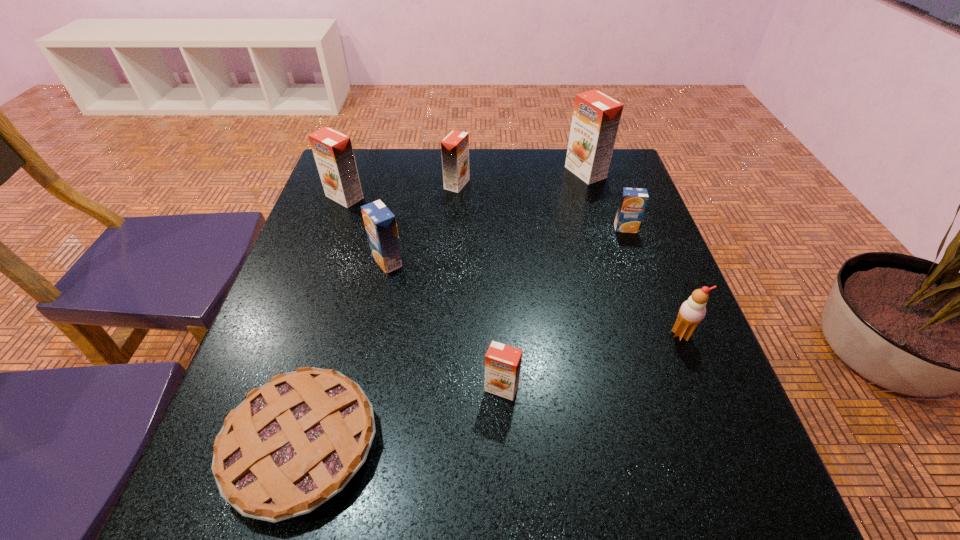
I want to click on the tallest orange juice, so click(596, 116).

What are the coordinates of `the biggest orange orange juice` in the screenshot? It's located at (596, 116).

In order to click on the seventh shortest object in this screenshot , I will do `click(332, 150)`.

The width and height of the screenshot is (960, 540). Find the location of `the leftmost orange orange juice`. the leftmost orange orange juice is located at coordinates point(332,150).

You are a GUI agent. You are given a task and a screenshot of the screen. Output one action in this format:
    pyautogui.click(x=<x>, y=<y>)
    Task: Click on the third orange orange juice from right to left
    The height and width of the screenshot is (540, 960).
    Given the screenshot: What is the action you would take?
    pyautogui.click(x=455, y=146)

The height and width of the screenshot is (540, 960). What are the coordinates of `the fourth orange juice from right to left` in the screenshot? It's located at (455, 146).

The image size is (960, 540). I want to click on the left blue orange_juice, so click(380, 223).

This screenshot has height=540, width=960. What are the coordinates of `the fifth orange juice from right to left` in the screenshot? It's located at (380, 223).

Locate an element on the screen. the third nearest object is located at coordinates (692, 311).

Locate an element on the screen. The height and width of the screenshot is (540, 960). the third nearest orange juice is located at coordinates (633, 201).